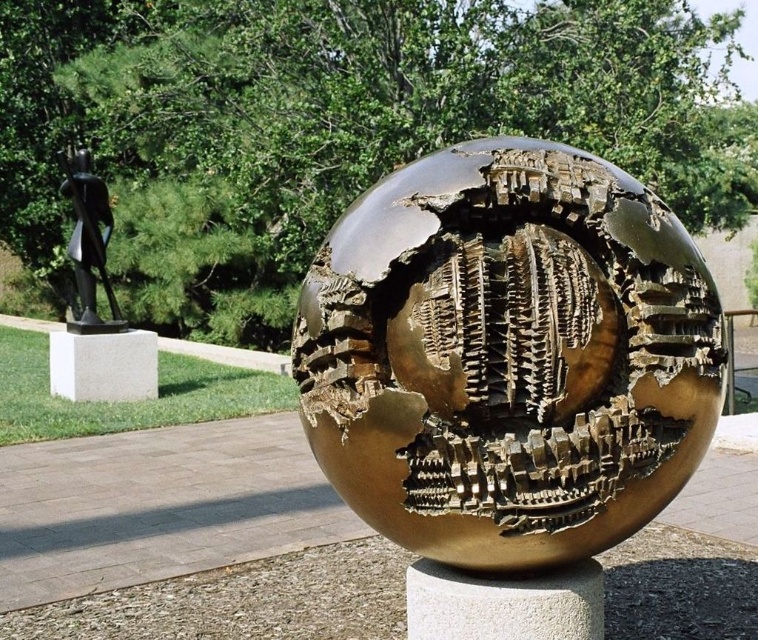
Is point (669, 317) positioned in front of point (506, 577)?

Yes, point (669, 317) is closer to viewer.

Is point (352, 262) less distant than point (484, 604)?

Yes, it is in front of point (484, 604).

The image size is (758, 640). Identify the location of gold textured sphere at center. (509, 355).

Can you confirm if white stone pillar at center is wider than white marble pillar at lower left?

Incorrect, white stone pillar at center's width does not surpass white marble pillar at lower left's.

Locate an element on the screen. The width and height of the screenshot is (758, 640). white stone pillar at center is located at coordinates (503, 602).

Is point (497, 634) less distant than point (60, 353)?

Yes, point (497, 634) is closer to viewer.

Find the location of a particular element. The width and height of the screenshot is (758, 640). white stone pillar at center is located at coordinates (503, 602).

Does point (522, 291) come in front of point (92, 284)?

Yes, it is.

Consider the image. Measure the distance from gold textured sphere at center to bronze statue at left.

gold textured sphere at center and bronze statue at left are 9.00 meters apart from each other.

Does point (396, 205) come behind point (111, 317)?

No, (396, 205) is closer to viewer.

Identify the location of gold textured sphere at center. (509, 355).